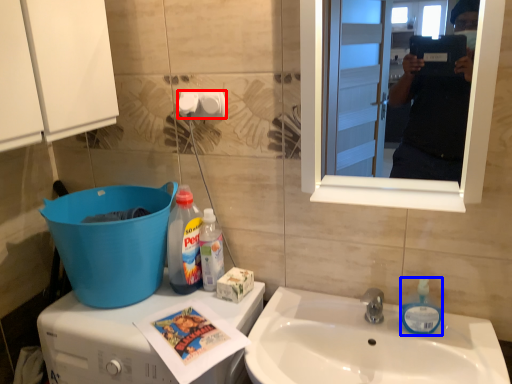
Question: Which of the following is the closest to the observer, toilet paper (highlighted by a red box) or toiletries (highlighted by a blue box)?

Choices:
 (A) toilet paper
 (B) toiletries

Answer: (B)